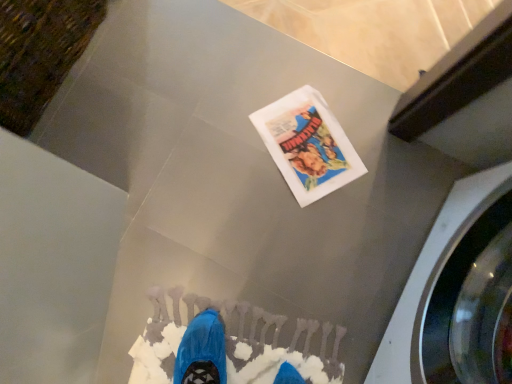
Identify the location of vacant space situated above white paper flyer at center (from a real-world perspective). Image resolution: width=512 pixels, height=384 pixels. (313, 143).